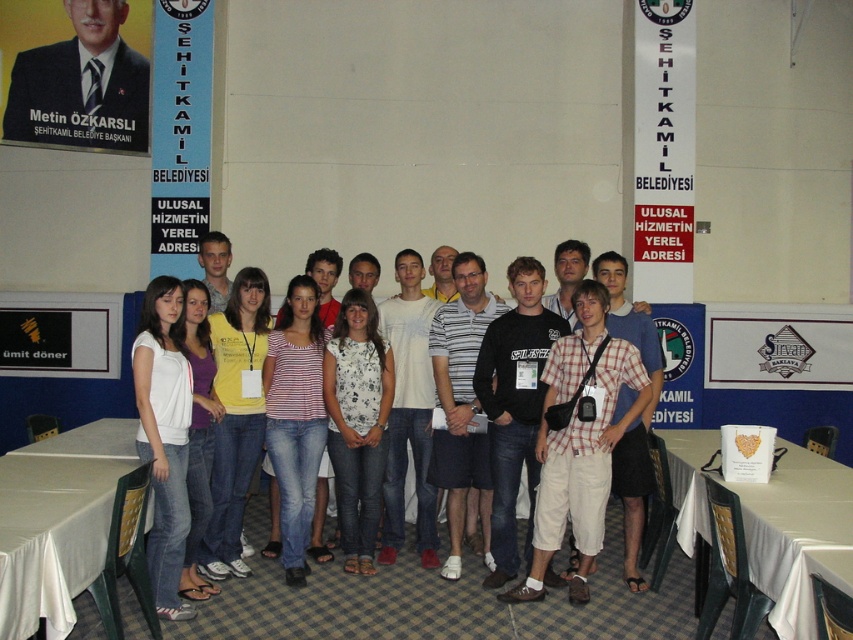
Looking at this image, you are a photographer adjusting your camera settings to capture the entire scene. You notice the matte black suit at upper left and the white fabric table at lower right in your viewfinder. Which object appears wider in the frame?

The matte black suit at upper left appears wider in the frame because its width surpasses that of the white fabric table at lower right.

You are a photographer setting up for a group photo in a checkered floor room. You have a white fabric table at lower right and a white cotton shirt at center. Which object is larger in size?

The white fabric table at lower right is bigger than the white cotton shirt at center according to the description.

You are a photographer setting up for a group photo. You notice the matte black suit at upper left and the white fabric table at lower right. Which object is located more to the left in the scene?

The matte black suit at upper left is positioned on the left side of the white fabric table at lower right, so it is more to the left.